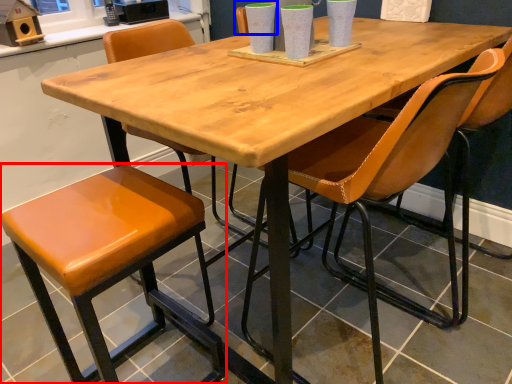
Question: Which of the following is the farthest to the observer, stool (highlighted by a red box) or chair (highlighted by a blue box)?

Choices:
 (A) stool
 (B) chair

Answer: (B)